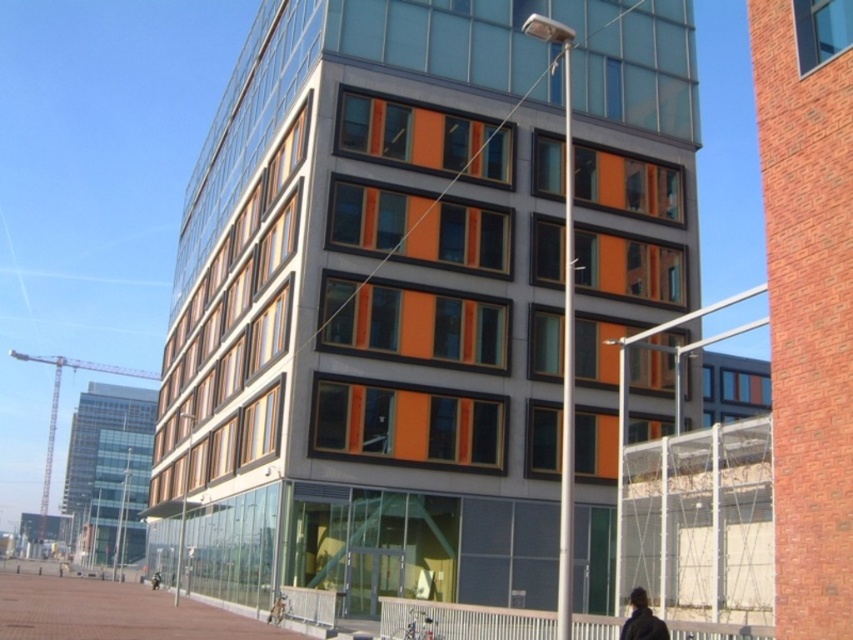
You are standing in front of the modern multi story building and want to locate the dark brown leather jacket at lower right. According to the coordinates provided, where exactly would you find it?

The dark brown leather jacket at lower right is located at point [642,620].

You are a delivery person who needs to park your bicycle on the brick pavement at lower left without blocking the dark brown leather jacket at lower right. Can you fit your bicycle there?

The brick pavement at lower left is bigger than the dark brown leather jacket at lower right, so yes, you can park your bicycle there without blocking the jacket since there is enough space.

You are a photographer trying to capture both the dark brown leather jacket at lower right and the dark gray jacket at lower center in a single frame. Given their sizes, which jacket will appear larger in your photo?

The dark gray jacket at lower center will appear larger in the photo because it is bigger than the dark brown leather jacket at lower right.